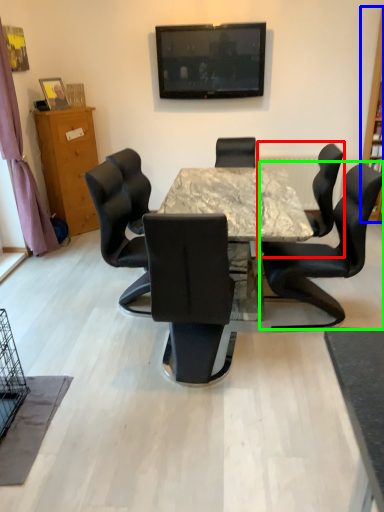
Question: Which is farther away from chair (highlighted by a red box)? bookshelf (highlighted by a blue box) or chair (highlighted by a green box)?

Choices:
 (A) bookshelf
 (B) chair

Answer: (A)